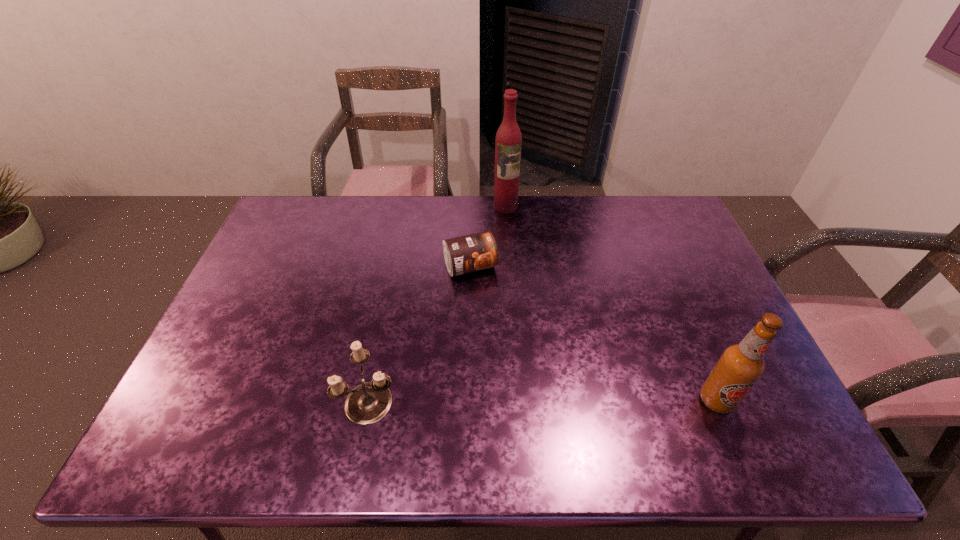
What are the coordinates of `free space that is in between the third shortest object and the liquor` in the screenshot? It's located at [611, 303].

Find the location of a particular element. The image size is (960, 540). unoccupied position between the candle holder and the shortest object is located at coordinates (420, 333).

Identify the location of empty location between the second tallest object and the second farthest object. The height and width of the screenshot is (540, 960). (593, 333).

Find the location of a particular element. free point between the tallest object and the second tallest object is located at coordinates (611, 303).

Point out which object is positioned as the nearest to the third nearest object. Please provide its 2D coordinates. Your answer should be formatted as a tuple, i.e. [(x, y)], where the tuple contains the x and y coordinates of a point satisfying the conditions above.

[(508, 142)]

Locate which object ranks in proximity to the second tallest object. Please provide its 2D coordinates. Your answer should be formatted as a tuple, i.e. [(x, y)], where the tuple contains the x and y coordinates of a point satisfying the conditions above.

[(478, 251)]

Identify the location of vacant space that satisfies the following two spatial constraints: 1. on the back side of the candle holder; 2. on the left side of the can. This screenshot has width=960, height=540. (396, 267).